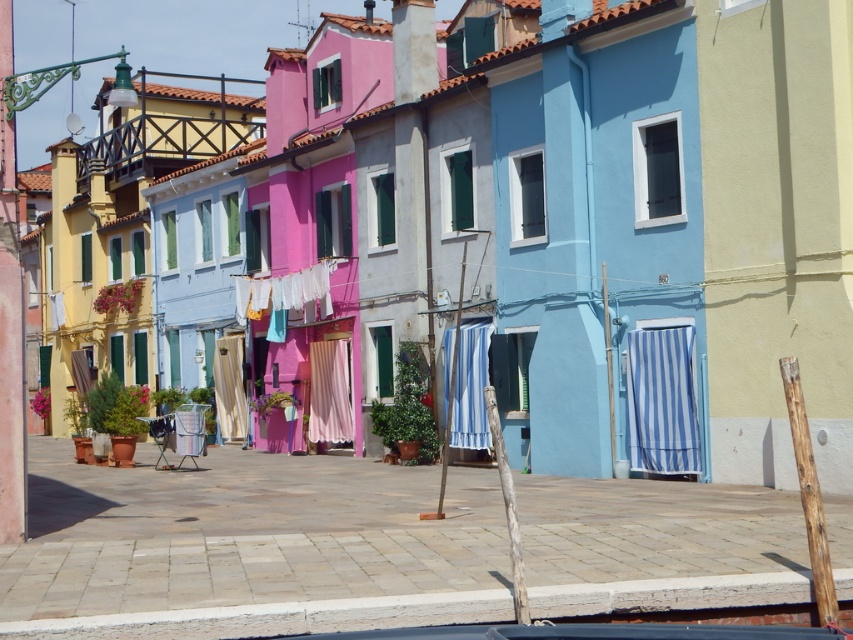
Question: Can you confirm if blue striped fabric at center is smaller than matte beige curtain at center?

Choices:
 (A) yes
 (B) no

Answer: (A)

Question: Is blue striped fabric at lower right positioned before matte beige curtain at center?

Choices:
 (A) no
 (B) yes

Answer: (B)

Question: Which of the following is the closest to the observer?

Choices:
 (A) pink fabric at center
 (B) blue striped fabric at lower right
 (C) blue striped fabric at center
 (D) matte beige curtain at center

Answer: (B)

Question: Which point is farther to the camera?

Choices:
 (A) blue striped fabric at center
 (B) matte beige curtain at center

Answer: (B)

Question: Which is nearer to the pink fabric at center?

Choices:
 (A) blue striped fabric at center
 (B) matte beige curtain at center
 (C) blue striped fabric at lower right

Answer: (B)

Question: Is blue striped fabric at center smaller than pink fabric at center?

Choices:
 (A) no
 (B) yes

Answer: (B)